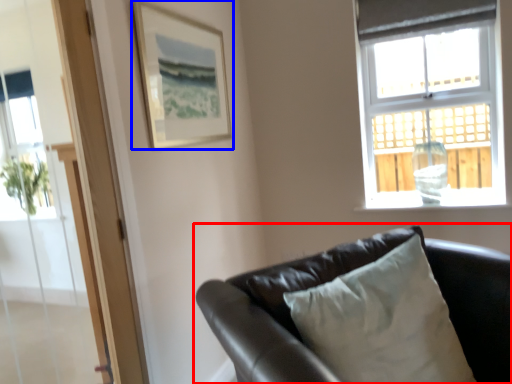
Question: Which object is further to the camera taking this photo, studio couch (highlighted by a red box) or picture frame (highlighted by a blue box)?

Choices:
 (A) studio couch
 (B) picture frame

Answer: (B)